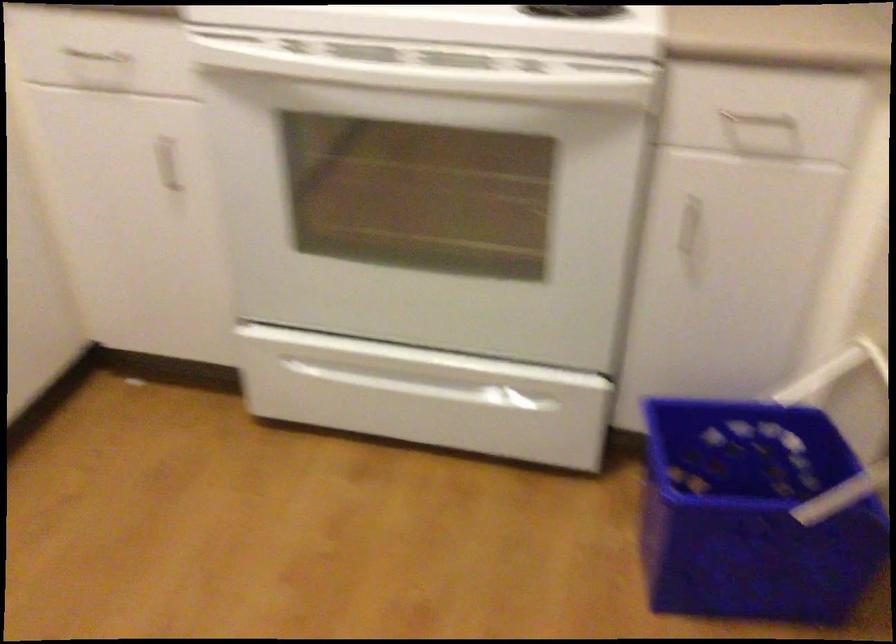
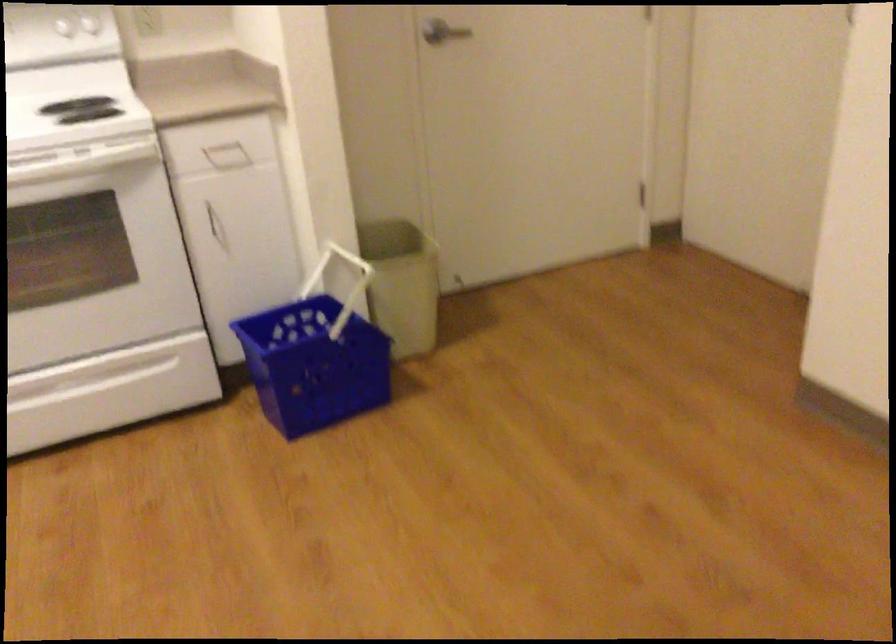
Where in the second image is the point corresponding to (759,138) from the first image?

(227, 156)